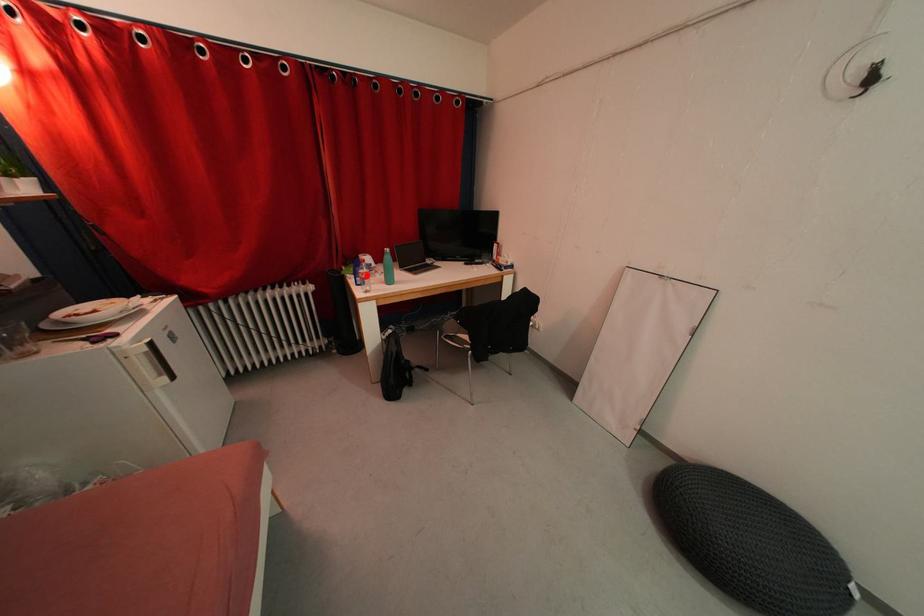
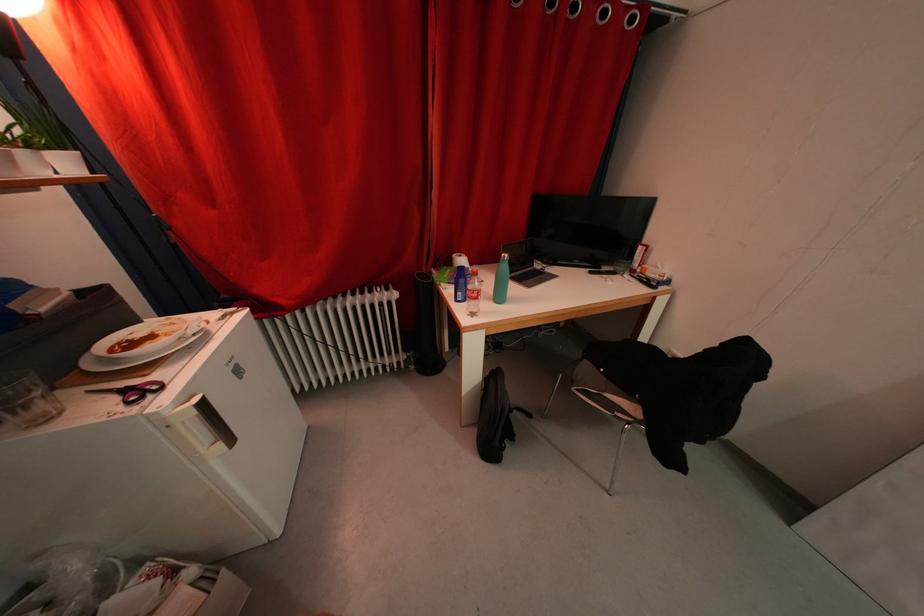
Question: I am providing you with two images of the same scene from different viewpoints. In image1, a red point is highlighted. Considering the same 3D point in image2, which of the following is correct?

Choices:
 (A) It is closer
 (B) It is farther

Answer: (B)